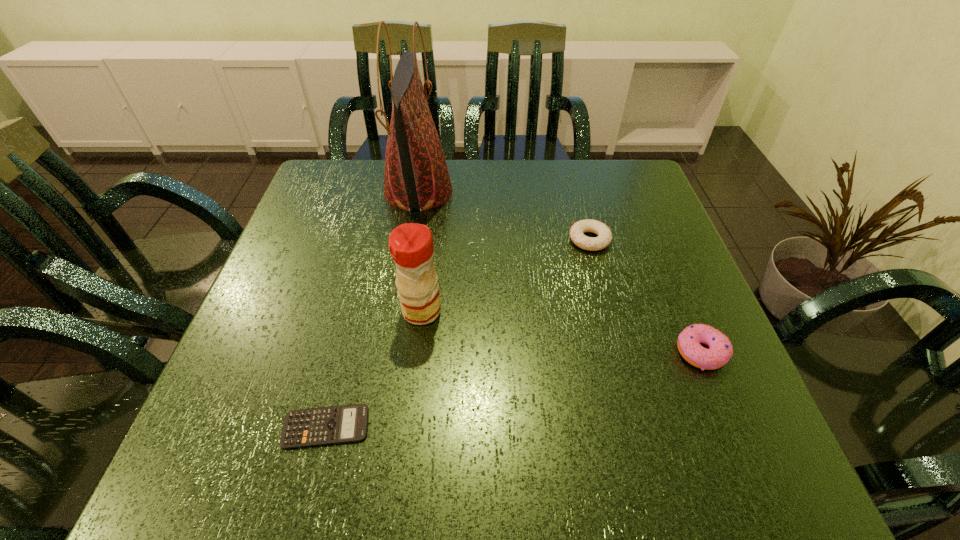
Locate an element on the screen. The width and height of the screenshot is (960, 540). the farthest object is located at coordinates (416, 176).

At what (x,y) coordinates should I click in order to perform the action: click on the tallest object. Please return your answer as a coordinate pair (x, y). This screenshot has width=960, height=540. Looking at the image, I should click on (416, 176).

Find the location of `the third nearest object`. the third nearest object is located at coordinates (411, 246).

Locate an element on the screen. The width and height of the screenshot is (960, 540). condiment is located at coordinates (411, 246).

I want to click on the rightmost object, so click(720, 351).

Identify the location of the third shortest object. The width and height of the screenshot is (960, 540). (720, 351).

Locate an element on the screen. This screenshot has height=540, width=960. the farther doughnut is located at coordinates (604, 238).

The width and height of the screenshot is (960, 540). I want to click on the fourth object from left to right, so click(x=604, y=238).

Identify the location of the shortest object. (348, 423).

Locate an element on the screen. calculator is located at coordinates (348, 423).